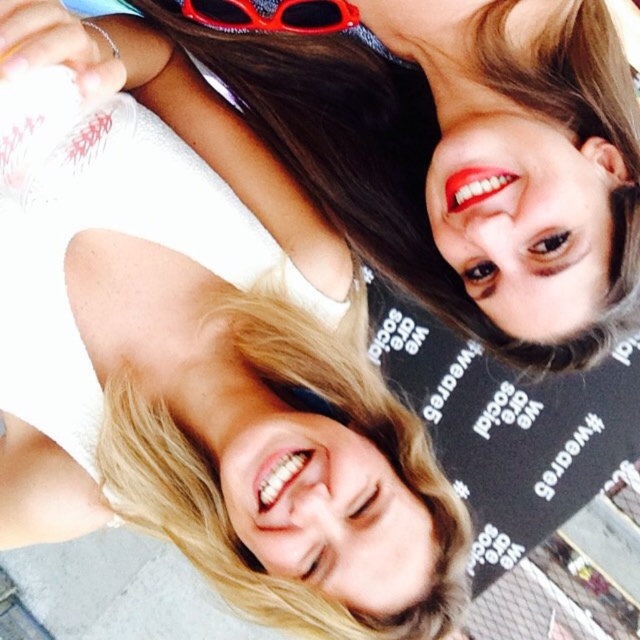
Is smooth skin face at upper right shorter than red plastic goggles at upper center?

No.

Does smooth skin face at upper right appear on the left side of red plastic goggles at upper center?

Indeed, smooth skin face at upper right is positioned on the left side of red plastic goggles at upper center.

What do you see at coordinates (198, 348) in the screenshot?
I see `smooth skin face at upper right` at bounding box center [198, 348].

What are the coordinates of `smooth skin face at upper right` in the screenshot? It's located at [198, 348].